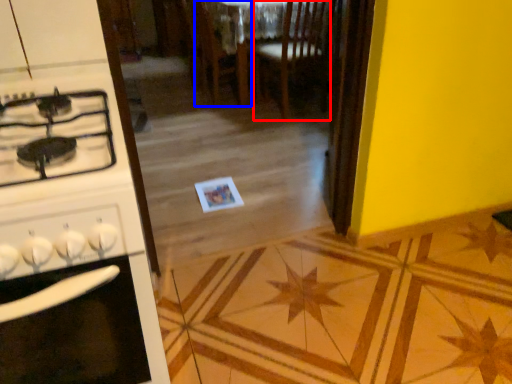
Question: Among these objects, which one is nearest to the camera, chair (highlighted by a red box) or chair (highlighted by a blue box)?

Choices:
 (A) chair
 (B) chair

Answer: (A)